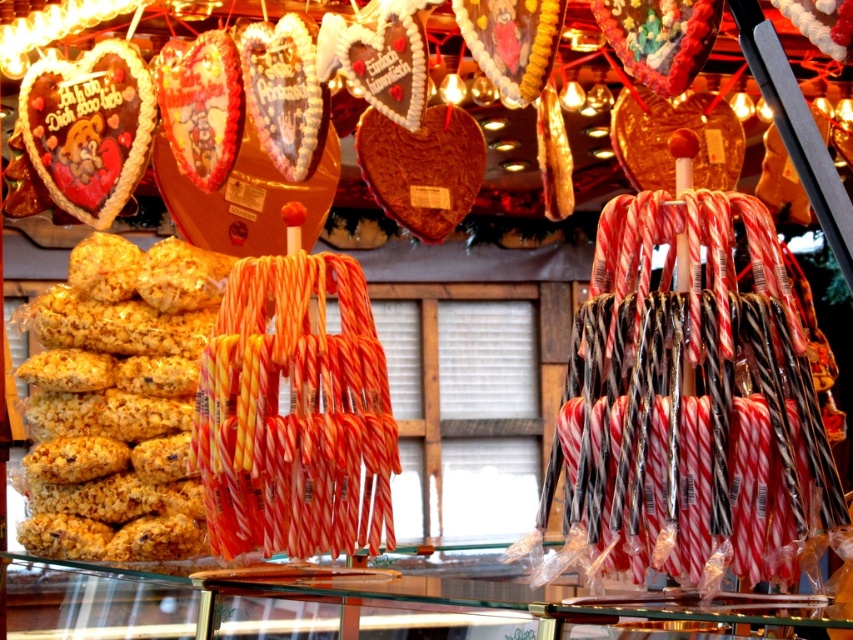
You are a customer at the market stall and want to buy the crispy yellow popcorn at left. Where exactly should you look to find it?

The crispy yellow popcorn at left is located at the coordinates point (119,401).

You are standing at the market stall and want to pick up an item. Which of the two points, point (x=28, y=412) or point (x=148, y=77), is closer to you?

Point (x=28, y=412) is closer to you because it is further to the camera than point (x=148, y=77).

You are setting up a display for a holiday market and need to arrange two items from the scene. The crispy yellow popcorn at left and the matte chocolate heart at upper left must be placed side by side. Which item should you place on the left side of the display to ensure it doesn not get obscured by the other?

You should place the crispy yellow popcorn at left on the left side of the display since it is wider than the matte chocolate heart at upper left, preventing it from being obscured by the narrower chocolate heart.